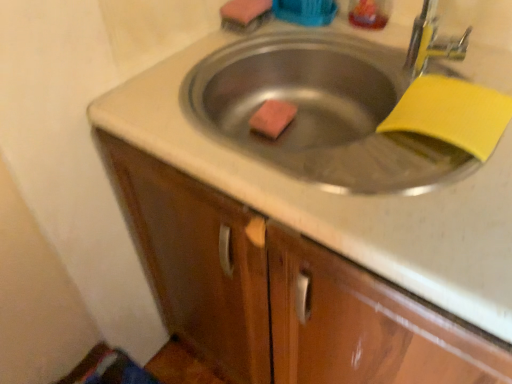
You are a GUI agent. You are given a task and a screenshot of the screen. Output one action in this format:
    pyautogui.click(x=<x>, y=<y>)
    Task: Click on the free space in front of translucent plastic liquid at upper right
    The height and width of the screenshot is (384, 512).
    Given the screenshot: What is the action you would take?
    pyautogui.click(x=392, y=50)